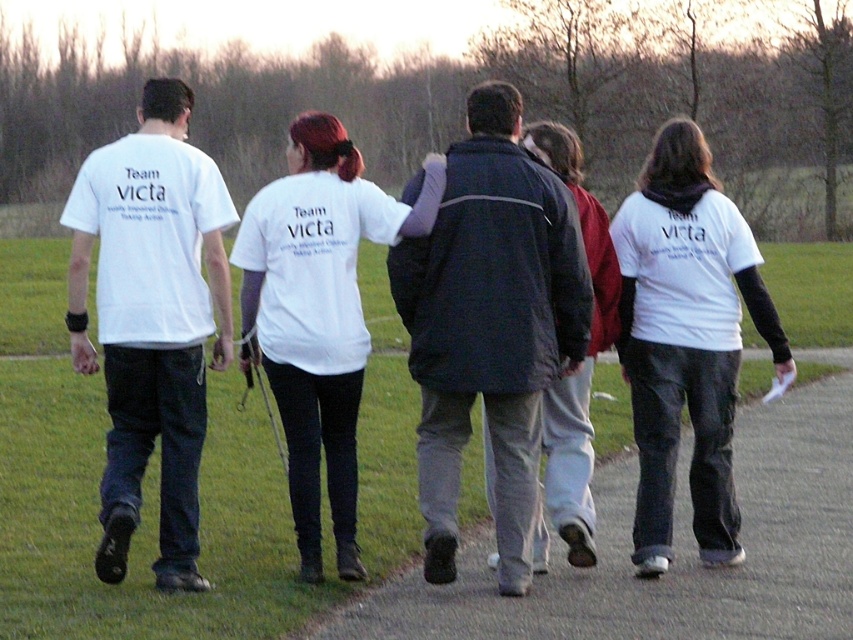
Measure the distance from smooth concrete pavement at center to white matte t-shirt at left.

The distance of smooth concrete pavement at center from white matte t-shirt at left is 14.70 feet.

Is point (788, 520) closer to viewer compared to point (189, 372)?

No, it is behind (189, 372).

Which is behind, point (479, 570) or point (109, 336)?

Point (479, 570)

This screenshot has height=640, width=853. In order to click on smooth concrete pavement at center in this screenshot , I will do (674, 548).

Who is more forward, (343, 218) or (540, 120)?

Point (343, 218) is in front.

Does white matte t-shirt at center have a lesser height compared to dark gray jacket at center?

Correct, white matte t-shirt at center is not as tall as dark gray jacket at center.

Is point (306, 440) in front of point (602, 269)?

That is True.

This screenshot has width=853, height=640. Find the location of `white matte t-shirt at center`. white matte t-shirt at center is located at coordinates (318, 314).

Is point (404, 193) farther from viewer compared to point (314, 168)?

No.

Is point (502, 202) closer to camera compared to point (335, 362)?

Yes, it is in front of point (335, 362).

This screenshot has height=640, width=853. I want to click on dark blue jacket at center, so click(490, 324).